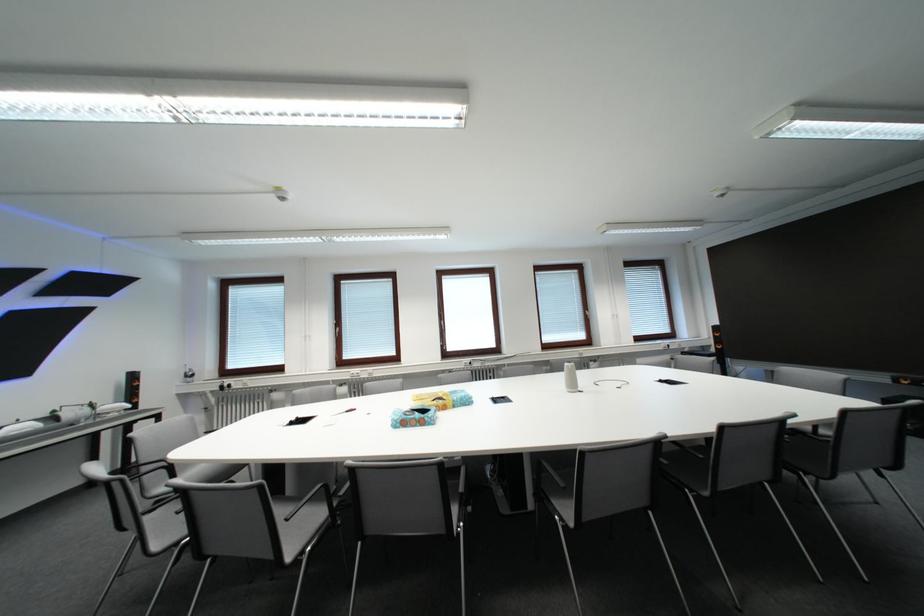
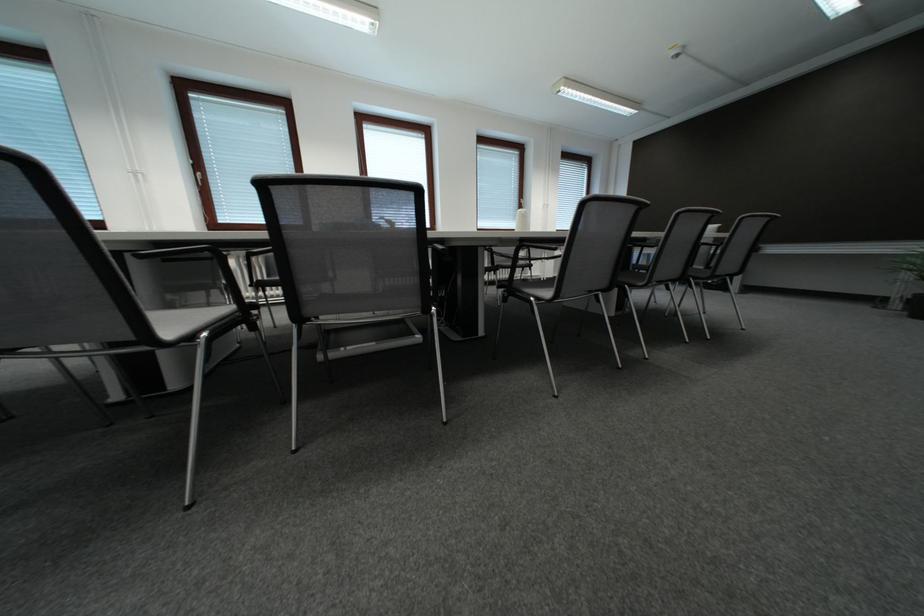
How did the camera likely rotate?

The camera's rotation is toward right-down.